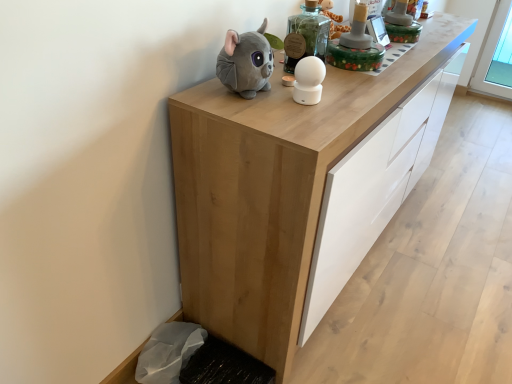
Question: Would you say natural wood cabinet at center is to the left or to the right of white matte ball at center, which is the 2th toy in left-to-right order, in the picture?

Choices:
 (A) left
 (B) right

Answer: (B)

Question: From the image's perspective, is natural wood cabinet at center positioned above or below white matte ball at center, which is counted as the 1th toy, starting from the right?

Choices:
 (A) below
 (B) above

Answer: (A)

Question: Estimate the real-world distances between objects in this image. Which object is closer to the natural wood cabinet at center?

Choices:
 (A) white matte ball at center, which is the 2th toy in left-to-right order
 (B) soft gray plush toy at upper center, marked as the second toy in a right-to-left arrangement

Answer: (B)

Question: Which of these objects is positioned farthest from the soft gray plush toy at upper center, marked as the second toy in a right-to-left arrangement?

Choices:
 (A) white matte ball at center, which is the 2th toy in left-to-right order
 (B) natural wood cabinet at center

Answer: (B)